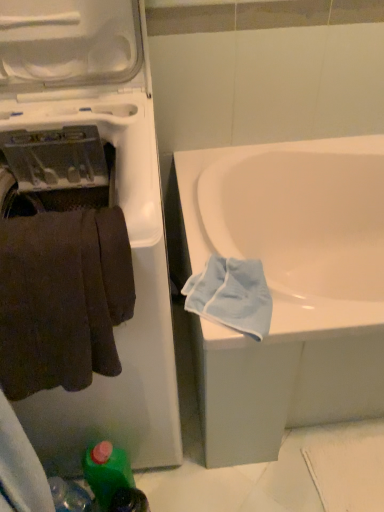
At what (x,y) coordinates should I click in order to perform the action: click on green plastic bottle at lower left. Please return your answer as a coordinate pair (x, y). Looking at the image, I should click on (106, 471).

What do you see at coordinates (289, 287) in the screenshot?
I see `white glossy bathtub at center` at bounding box center [289, 287].

This screenshot has width=384, height=512. Describe the element at coordinates (231, 295) in the screenshot. I see `light blue cotton towel at lower right` at that location.

Where is `white plastic washing machine at left`? The image size is (384, 512). white plastic washing machine at left is located at coordinates (94, 204).

You are a GUI agent. You are given a task and a screenshot of the screen. Output one action in this format:
    pyautogui.click(x=<x>, y=<y>)
    Task: Click on the green plastic bottle at lower left
    This screenshot has width=384, height=512.
    Given the screenshot: What is the action you would take?
    pyautogui.click(x=106, y=471)

Could you tell me if dark brown fabric towel at left is facing white plastic washing machine at left?

Yes.

Is dark brown fabric towel at left to the right of white plastic washing machine at left from the viewer's perspective?

Yes, dark brown fabric towel at left is to the right of white plastic washing machine at left.

Does point (92, 271) appear closer or farther from the camera than point (60, 148)?

Point (92, 271) is closer to the camera than point (60, 148).

How many degrees apart are the facing directions of white plastic washing machine at left and green plastic bottle at lower left?

There is a 2.21e-05-degree angle between the facing directions of white plastic washing machine at left and green plastic bottle at lower left.

Is white plastic washing machine at left oriented towards green plastic bottle at lower left?

Yes, white plastic washing machine at left is facing green plastic bottle at lower left.

How distant is white plastic washing machine at left from green plastic bottle at lower left?

A distance of 14.80 inches exists between white plastic washing machine at left and green plastic bottle at lower left.

Is white plastic washing machine at left not near green plastic bottle at lower left?

They are positioned close to each other.

Can you confirm if green plastic bottle at lower left is shorter than white glossy bathtub at center?

Correct, green plastic bottle at lower left is not as tall as white glossy bathtub at center.

Does green plastic bottle at lower left have a larger size compared to white glossy bathtub at center?

Actually, green plastic bottle at lower left might be smaller than white glossy bathtub at center.

Considering the relative sizes of green plastic bottle at lower left and white glossy bathtub at center in the image provided, is green plastic bottle at lower left wider than white glossy bathtub at center?

In fact, green plastic bottle at lower left might be narrower than white glossy bathtub at center.

At what (x,y) coordinates should I click in order to perform the action: click on towel above the green plastic bottle at lower left (from the image's perspective). Please return your answer as a coordinate pair (x, y). This screenshot has height=512, width=384. Looking at the image, I should click on (62, 298).

From the image's perspective, is dark brown fabric towel at left under green plastic bottle at lower left?

Incorrect, from the image's perspective, dark brown fabric towel at left is higher than green plastic bottle at lower left.

Does dark brown fabric towel at left appear on the right side of green plastic bottle at lower left?

Incorrect, dark brown fabric towel at left is not on the right side of green plastic bottle at lower left.

Which of these two, dark brown fabric towel at left or green plastic bottle at lower left, is wider?

dark brown fabric towel at left is wider.

Considering the relative sizes of white glossy bathtub at center and dark brown fabric towel at left in the image provided, is white glossy bathtub at center shorter than dark brown fabric towel at left?

No, white glossy bathtub at center is not shorter than dark brown fabric towel at left.

At what (x,y) coordinates should I click in order to perform the action: click on towel positioned vertically above the white glossy bathtub at center (from a real-world perspective). Please return your answer as a coordinate pair (x, y). Looking at the image, I should click on (62, 298).

Is white glossy bathtub at center not near dark brown fabric towel at left?

No, there isn't a large distance between white glossy bathtub at center and dark brown fabric towel at left.

Can you tell me how much green plastic bottle at lower left and light blue cotton towel at lower right differ in facing direction?

The angular difference between green plastic bottle at lower left and light blue cotton towel at lower right is 3.42 degrees.

Which is correct: green plastic bottle at lower left is inside light blue cotton towel at lower right, or outside of it?

The correct answer is: outside.

Is point (101, 482) closer to camera compared to point (217, 268)?

That is False.

Is point (250, 333) closer or farther from the camera than point (49, 252)?

Point (250, 333) is farther from the camera than point (49, 252).

Is light blue cotton towel at lower right aimed at dark brown fabric towel at left?

No, light blue cotton towel at lower right is not aimed at dark brown fabric towel at left.

Considering the sizes of objects light blue cotton towel at lower right and dark brown fabric towel at left in the image provided, who is wider, light blue cotton towel at lower right or dark brown fabric towel at left?

light blue cotton towel at lower right is wider.

Is light blue cotton towel at lower right next to dark brown fabric towel at left?

There is a gap between light blue cotton towel at lower right and dark brown fabric towel at left.

Locate an element on the screen. washing machine above the dark brown fabric towel at left (from the image's perspective) is located at coordinates (94, 204).

Find the location of `washing machine that appears on the left of green plastic bottle at lower left`. washing machine that appears on the left of green plastic bottle at lower left is located at coordinates (94, 204).

Which object lies nearer to the anchor point white plastic washing machine at left, white glossy bathtub at center or dark brown fabric towel at left?

Among the two, dark brown fabric towel at left is located nearer to white plastic washing machine at left.

Estimate the real-world distances between objects in this image. Which object is closer to white plastic washing machine at left, light blue cotton towel at lower right or dark brown fabric towel at left?

Among the two, dark brown fabric towel at left is located nearer to white plastic washing machine at left.

Which object lies nearer to the anchor point dark brown fabric towel at left, green plastic bottle at lower left or white glossy bathtub at center?

Among the two, green plastic bottle at lower left is located nearer to dark brown fabric towel at left.

Estimate the real-world distances between objects in this image. Which object is further from white glossy bathtub at center, green plastic bottle at lower left or white plastic washing machine at left?

green plastic bottle at lower left.

Estimate the real-world distances between objects in this image. Which object is further from white glossy bathtub at center, light blue cotton towel at lower right or dark brown fabric towel at left?

The object further to white glossy bathtub at center is dark brown fabric towel at left.

Considering their positions, is white plastic washing machine at left positioned closer to dark brown fabric towel at left than green plastic bottle at lower left?

Among the two, white plastic washing machine at left is located nearer to dark brown fabric towel at left.

Which object lies nearer to the anchor point white glossy bathtub at center, dark brown fabric towel at left or white plastic washing machine at left?

Based on the image, white plastic washing machine at left appears to be nearer to white glossy bathtub at center.

Looking at the image, which one is located further to white glossy bathtub at center, dark brown fabric towel at left or light blue cotton towel at lower right?

Based on the image, dark brown fabric towel at left appears to be further to white glossy bathtub at center.

Identify the location of bath towel that lies between white plastic washing machine at left and green plastic bottle at lower left from top to bottom. (231, 295).

Locate an element on the screen. The width and height of the screenshot is (384, 512). towel located between white plastic washing machine at left and light blue cotton towel at lower right in the left-right direction is located at coordinates (62, 298).

The image size is (384, 512). Find the location of `bath towel between green plastic bottle at lower left and white glossy bathtub at center from left to right`. bath towel between green plastic bottle at lower left and white glossy bathtub at center from left to right is located at coordinates (231, 295).

Image resolution: width=384 pixels, height=512 pixels. Find the location of `towel between white plastic washing machine at left and green plastic bottle at lower left in the vertical direction`. towel between white plastic washing machine at left and green plastic bottle at lower left in the vertical direction is located at coordinates (62, 298).